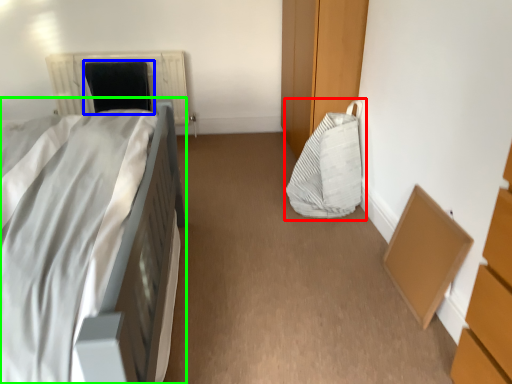
Question: Estimate the real-world distances between objects in this image. Which object is farther from bean bag chair (highlighted by a red box), bean bag chair (highlighted by a blue box) or bed (highlighted by a green box)?

Choices:
 (A) bean bag chair
 (B) bed

Answer: (A)